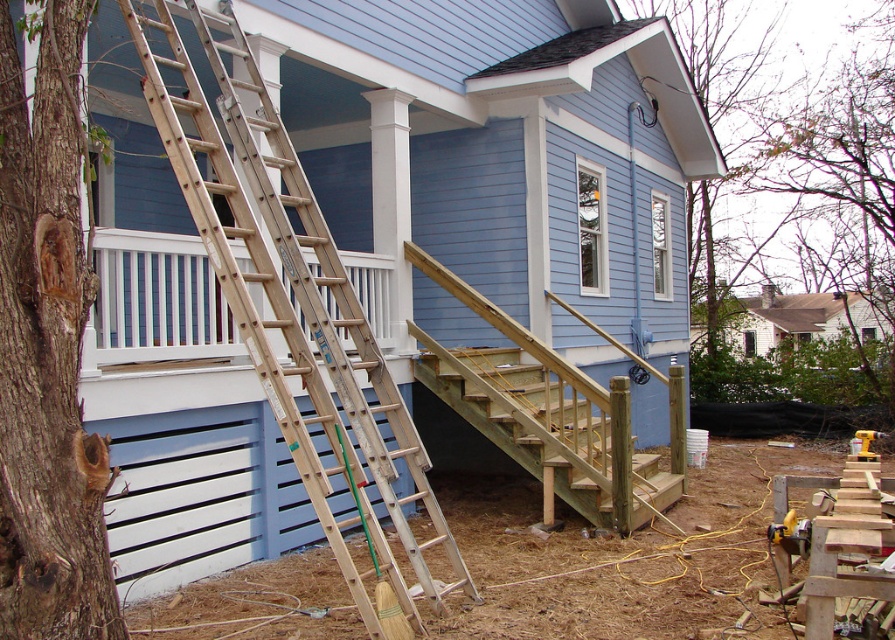
Question: Which object appears farthest from the camera in this image?

Choices:
 (A) wooden ladder at left
 (B) wooden stairs at center

Answer: (B)

Question: Among these objects, which one is nearest to the camera?

Choices:
 (A) brown rough bark tree at left
 (B) wooden stairs at center
 (C) wooden ladder at left

Answer: (A)

Question: Is brown rough bark tree at left wider than wooden stairs at center?

Choices:
 (A) yes
 (B) no

Answer: (B)

Question: Does wooden ladder at left appear on the left side of brown rough bark tree at left?

Choices:
 (A) yes
 (B) no

Answer: (B)

Question: Which object is farther from the camera taking this photo?

Choices:
 (A) wooden ladder at left
 (B) wooden stairs at center

Answer: (B)

Question: Is wooden ladder at left below wooden stairs at center?

Choices:
 (A) no
 (B) yes

Answer: (A)